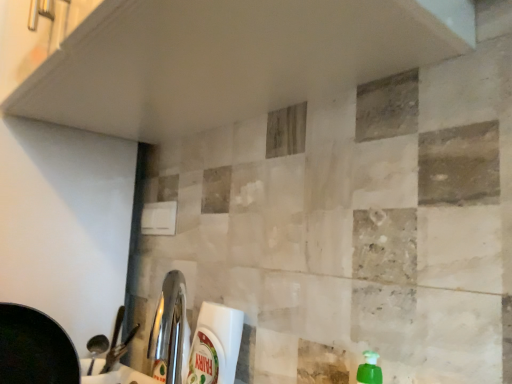
Locate an element on the screen. The image size is (512, 384). white plastic bottle at lower center is located at coordinates (215, 345).

The image size is (512, 384). Describe the element at coordinates (215, 345) in the screenshot. I see `white plastic bottle at lower center` at that location.

The width and height of the screenshot is (512, 384). What are the coordinates of `white glossy countertop at lower left` in the screenshot? It's located at (113, 374).

The image size is (512, 384). Describe the element at coordinates (113, 374) in the screenshot. I see `white glossy countertop at lower left` at that location.

Locate an element on the screen. white plastic bottle at lower center is located at coordinates (215, 345).

Between white glossy countertop at lower left and white plastic bottle at lower center, which one appears on the right side from the viewer's perspective?

From the viewer's perspective, white plastic bottle at lower center appears more on the right side.

Is white glossy countertop at lower left positioned behind white plastic bottle at lower center?

No, white glossy countertop at lower left is closer to the viewer.

Does point (140, 372) come in front of point (234, 363)?

No, it is behind (234, 363).

From the image's perspective, is white glossy countertop at lower left located above or below white plastic bottle at lower center?

From the image's perspective, white glossy countertop at lower left appears below white plastic bottle at lower center.

From a real-world perspective, is white glossy countertop at lower left positioned over white plastic bottle at lower center based on gravity?

No, from a real-world perspective, white glossy countertop at lower left is not over white plastic bottle at lower center

Between white glossy countertop at lower left and white plastic bottle at lower center, which one has smaller width?

Thinner between the two is white plastic bottle at lower center.

Considering the relative sizes of white glossy countertop at lower left and white plastic bottle at lower center in the image provided, is white glossy countertop at lower left shorter than white plastic bottle at lower center?

Yes.

Considering the sizes of objects white glossy countertop at lower left and white plastic bottle at lower center in the image provided, who is bigger, white glossy countertop at lower left or white plastic bottle at lower center?

white plastic bottle at lower center is bigger.

Is white glossy countertop at lower left spatially inside white plastic bottle at lower center, or outside of it?

white glossy countertop at lower left lies outside white plastic bottle at lower center.

Is white glossy countertop at lower left placed right next to white plastic bottle at lower center?

No, white glossy countertop at lower left is not in contact with white plastic bottle at lower center.

Could you tell me if white glossy countertop at lower left is facing white plastic bottle at lower center?

No, white glossy countertop at lower left is not facing towards white plastic bottle at lower center.

How different are the orientations of white glossy countertop at lower left and white plastic bottle at lower center in degrees?

90.7 degrees separate the facing orientations of white glossy countertop at lower left and white plastic bottle at lower center.

How much distance is there between white glossy countertop at lower left and white plastic bottle at lower center?

white glossy countertop at lower left and white plastic bottle at lower center are 17.15 centimeters apart.

Locate an element on the screen. This screenshot has width=512, height=384. counter top in front of the white plastic bottle at lower center is located at coordinates (113, 374).

Can you confirm if white plastic bottle at lower center is positioned to the left of white glossy countertop at lower left?

Incorrect, white plastic bottle at lower center is not on the left side of white glossy countertop at lower left.

Does white plastic bottle at lower center come in front of white glossy countertop at lower left?

No, white plastic bottle at lower center is behind white glossy countertop at lower left.

Does point (202, 304) appear closer or farther from the camera than point (97, 382)?

Point (202, 304) is closer to the camera than point (97, 382).

From the image's perspective, is white plastic bottle at lower center under white glossy countertop at lower left?

No.

From a real-world perspective, which object stands above the other?

white plastic bottle at lower center.

Is white plastic bottle at lower center wider than white glossy countertop at lower left?

No, white plastic bottle at lower center is not wider than white glossy countertop at lower left.

In the scene shown: Does white plastic bottle at lower center have a greater height compared to white glossy countertop at lower left?

Correct, white plastic bottle at lower center is much taller as white glossy countertop at lower left.

Is white plastic bottle at lower center smaller than white glossy countertop at lower left?

Actually, white plastic bottle at lower center might be larger than white glossy countertop at lower left.

Is white plastic bottle at lower center not within white glossy countertop at lower left?

Yes.

Is white plastic bottle at lower center not near white glossy countertop at lower left?

That's not correct — white plastic bottle at lower center is a little close to white glossy countertop at lower left.

Is white plastic bottle at lower center oriented away from white glossy countertop at lower left?

No, white plastic bottle at lower center's orientation is not away from white glossy countertop at lower left.

What's the angular difference between white plastic bottle at lower center and white glossy countertop at lower left's facing directions?

The angular difference between white plastic bottle at lower center and white glossy countertop at lower left is 90.7 degrees.

The image size is (512, 384). What are the coordinates of `cleaning product behind the white glossy countertop at lower left` in the screenshot? It's located at pos(215,345).

Locate an element on the screen. The height and width of the screenshot is (384, 512). counter top lying below the white plastic bottle at lower center (from the image's perspective) is located at coordinates (113, 374).

Image resolution: width=512 pixels, height=384 pixels. In the image, there is a white glossy countertop at lower left. Find the location of `cleaning product above it (from the image's perspective)`. cleaning product above it (from the image's perspective) is located at coordinates (215, 345).